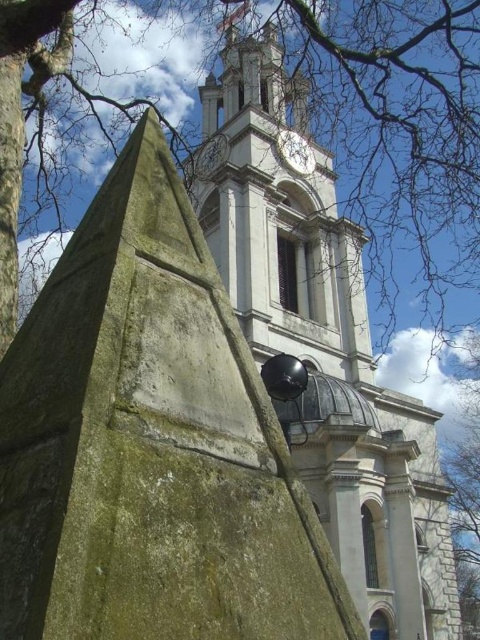
You are standing in front of the classical building and want to locate the point at coordinates (277, 216). According to the image, where exactly would this point be located?

The point at coordinates (277, 216) is on the white stone clock tower at upper center.

Looking at this image, you are an architect analyzing the building in the image. You notice the white stone clock tower at upper center and the white glossy clock at upper center. Which of these two objects is larger in size?

The white stone clock tower at upper center is bigger than the white glossy clock at upper center.

You are an architect analyzing the proportions of the building in the image. Which object, the white stone clock tower at upper center or the white glossy clock at upper center, occupies more vertical space in the scene?

The white stone clock tower at upper center occupies more vertical space because it has a greater height compared to the white glossy clock at upper center.